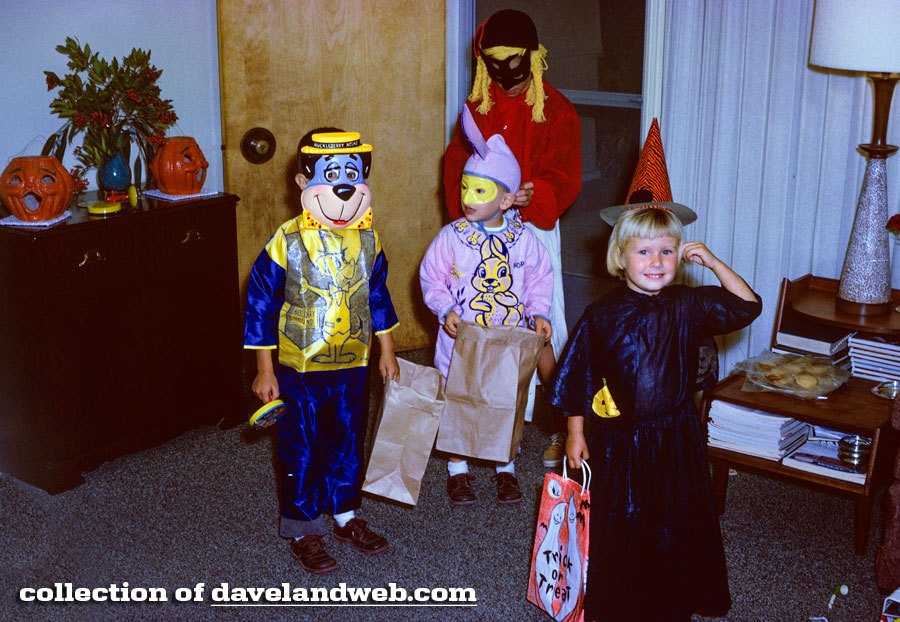
Find the location of a particular element. door is located at coordinates pos(356,72).